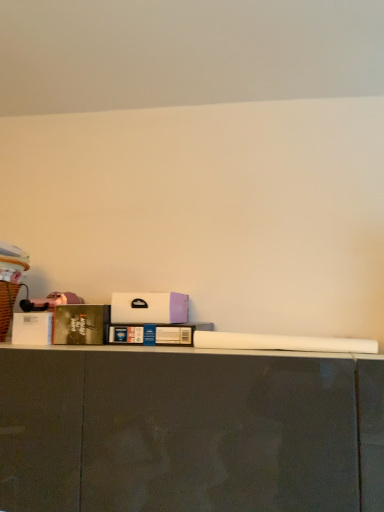
Question: In the image, is brown wicker laundry basket at left positioned in front of or behind blue cardboard book at center, which is counted as the second book, starting from the left?

Choices:
 (A) behind
 (B) front

Answer: (B)

Question: Visually, is brown wicker laundry basket at left positioned to the left or to the right of blue cardboard book at center, which is counted as the second book, starting from the left?

Choices:
 (A) right
 (B) left

Answer: (B)

Question: Which object is the closest to the blue cardboard book at center, which appears as the 1th book when viewed from the right?

Choices:
 (A) white matte box at center
 (B) brown wicker laundry basket at left
 (C) hardcover book at left, the 1th book in the left-to-right sequence

Answer: (A)

Question: Estimate the real-world distances between objects in this image. Which object is farther from the white matte box at center?

Choices:
 (A) hardcover book at left, the 1th book in the left-to-right sequence
 (B) brown wicker laundry basket at left
 (C) blue cardboard book at center, which is counted as the second book, starting from the left

Answer: (B)